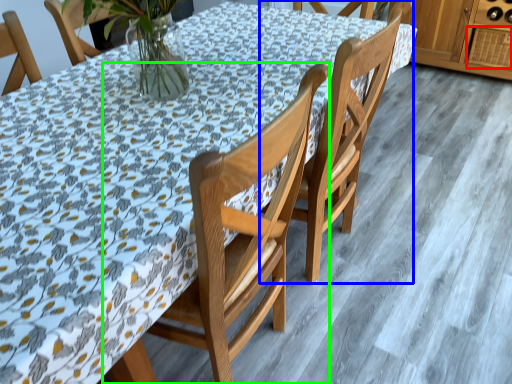
Question: Which object is the closest to the drawer (highlighted by a red box)? Choose among these: chair (highlighted by a blue box) or chair (highlighted by a green box).

Choices:
 (A) chair
 (B) chair

Answer: (A)